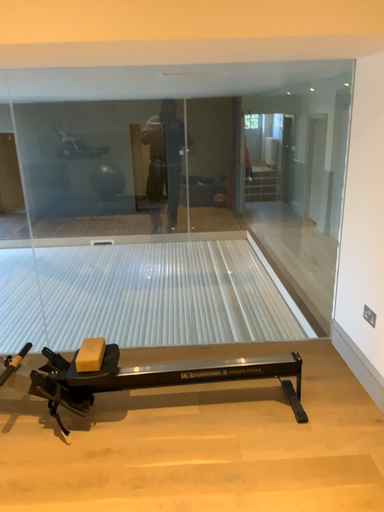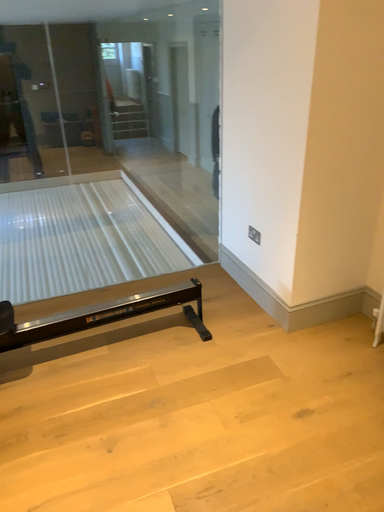
Question: How did the camera likely rotate when shooting the video?

Choices:
 (A) rotated downward
 (B) rotated upward

Answer: (A)